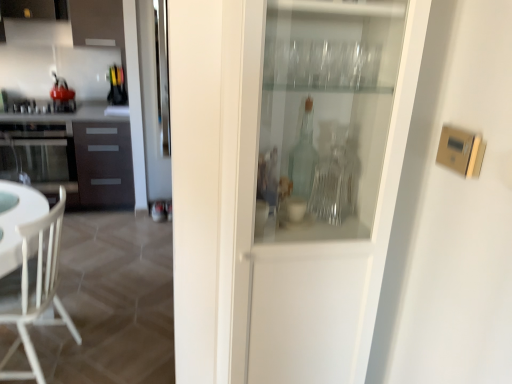
Question: Are white wood chair at lower left and dark brown wood cabinet at left located far from each other?

Choices:
 (A) no
 (B) yes

Answer: (B)

Question: Considering the relative positions of white wood chair at lower left and dark brown wood cabinet at left in the image provided, is white wood chair at lower left to the right of dark brown wood cabinet at left from the viewer's perspective?

Choices:
 (A) yes
 (B) no

Answer: (A)

Question: Is white wood chair at lower left wider than dark brown wood cabinet at left?

Choices:
 (A) yes
 (B) no

Answer: (A)

Question: From the image's perspective, does white wood chair at lower left appear higher than dark brown wood cabinet at left?

Choices:
 (A) yes
 (B) no

Answer: (B)

Question: Considering the relative sizes of white wood chair at lower left and dark brown wood cabinet at left in the image provided, is white wood chair at lower left smaller than dark brown wood cabinet at left?

Choices:
 (A) no
 (B) yes

Answer: (B)

Question: Is dark brown wood cabinet at left a part of white wood chair at lower left?

Choices:
 (A) yes
 (B) no

Answer: (B)

Question: Is metallic silver stove at left, marked as the 2th appliance in a top-to-bottom arrangement, to the left of transparent glass cabinet at center from the viewer's perspective?

Choices:
 (A) yes
 (B) no

Answer: (A)

Question: From a real-world perspective, is metallic silver stove at left, marked as the 2th appliance in a top-to-bottom arrangement, located beneath transparent glass cabinet at center?

Choices:
 (A) no
 (B) yes

Answer: (B)

Question: Are metallic silver stove at left, marked as the 2th appliance in a top-to-bottom arrangement, and transparent glass cabinet at center beside each other?

Choices:
 (A) yes
 (B) no

Answer: (B)

Question: Considering the relative sizes of metallic silver stove at left, the first appliance in the bottom-to-top sequence, and transparent glass cabinet at center in the image provided, is metallic silver stove at left, the first appliance in the bottom-to-top sequence, smaller than transparent glass cabinet at center?

Choices:
 (A) yes
 (B) no

Answer: (A)

Question: Can you confirm if metallic silver stove at left, marked as the 2th appliance in a top-to-bottom arrangement, is wider than transparent glass cabinet at center?

Choices:
 (A) yes
 (B) no

Answer: (A)

Question: Does metallic silver stove at left, marked as the 2th appliance in a top-to-bottom arrangement, appear on the right side of transparent glass cabinet at center?

Choices:
 (A) yes
 (B) no

Answer: (B)

Question: Could you tell me if metallic silver stove at left, marked as the 2th appliance in a top-to-bottom arrangement, is turned towards shiny red kettle at left, positioned as the 2th appliance in bottom-to-top order?

Choices:
 (A) no
 (B) yes

Answer: (A)